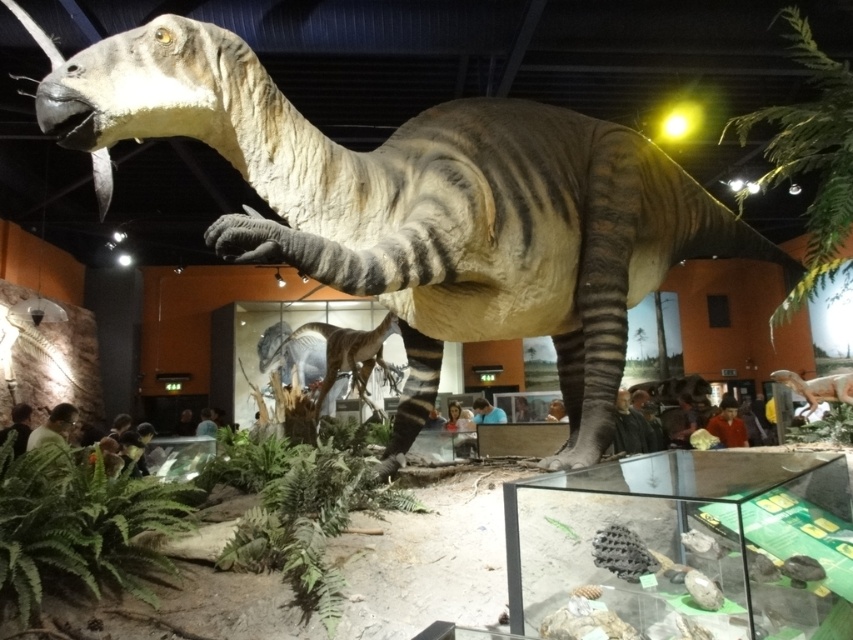
Question: Which object is closer to the camera taking this photo?

Choices:
 (A) matte gray dinosaur at center
 (B) smooth brown dinosaur at center

Answer: (A)

Question: Does matte gray dinosaur at center appear over smooth brown dinosaur at center?

Choices:
 (A) yes
 (B) no

Answer: (A)

Question: Which point appears farthest from the camera in this image?

Choices:
 (A) (361, 342)
 (B) (177, 125)

Answer: (A)

Question: Can you confirm if matte gray dinosaur at center is wider than smooth brown dinosaur at center?

Choices:
 (A) yes
 (B) no

Answer: (A)

Question: Does matte gray dinosaur at center have a larger size compared to smooth brown dinosaur at center?

Choices:
 (A) no
 (B) yes

Answer: (B)